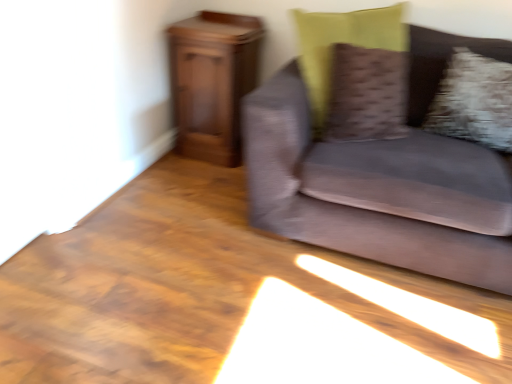
Question: Considering the positions of point (202, 39) and point (507, 185), is point (202, 39) closer or farther from the camera than point (507, 185)?

Choices:
 (A) closer
 (B) farther

Answer: (B)

Question: From the image's perspective, is wooden cabinet at left positioned above or below velvet gray couch at right?

Choices:
 (A) above
 (B) below

Answer: (A)

Question: Which of these objects is positioned farthest from the velvet gray couch at right?

Choices:
 (A) wooden cabinet at left
 (B) textured brown pillow at upper right, which appears as the first pillow when viewed from the left
 (C) fluffy white pillow at right, arranged as the 2th pillow when viewed from the left

Answer: (A)

Question: Considering the real-world distances, which object is farthest from the velvet gray couch at right?

Choices:
 (A) wooden cabinet at left
 (B) textured brown pillow at upper right, which appears as the first pillow when viewed from the left
 (C) fluffy white pillow at right, arranged as the 2th pillow when viewed from the left

Answer: (A)